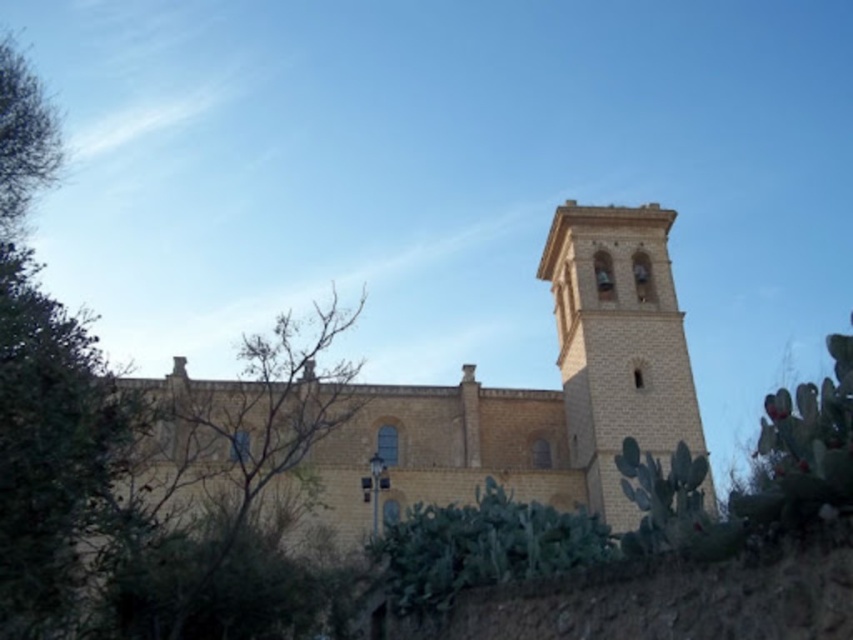
Question: Which object appears farthest from the camera in this image?

Choices:
 (A) green spiny cactus at lower center
 (B) yellow stone church at center
 (C) light beige stone bell tower at center right

Answer: (B)

Question: Which object appears closest to the camera in this image?

Choices:
 (A) green leafy tree at center
 (B) light beige stone bell tower at center right
 (C) green spiny cactus at lower center

Answer: (C)

Question: Is yellow stone church at center to the right of light beige stone bell tower at center right from the viewer's perspective?

Choices:
 (A) yes
 (B) no

Answer: (B)

Question: Which of the following is the farthest from the observer?

Choices:
 (A) (664, 390)
 (B) (51, 515)
 (C) (405, 576)

Answer: (A)

Question: Is yellow stone church at center above green leafy tree at center?

Choices:
 (A) no
 (B) yes

Answer: (A)

Question: Is green leafy tree at center below green spiny cactus at lower center?

Choices:
 (A) yes
 (B) no

Answer: (B)